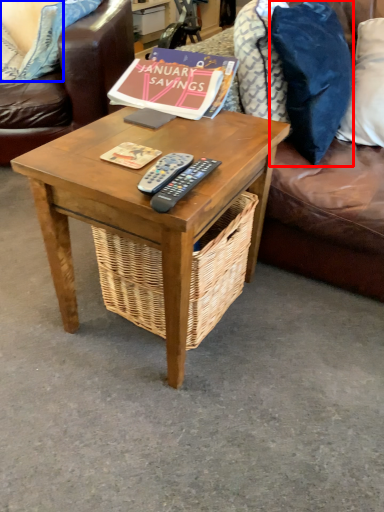
Question: Which of the following is the farthest to the observer, pillow (highlighted by a red box) or pillow (highlighted by a blue box)?

Choices:
 (A) pillow
 (B) pillow

Answer: (B)